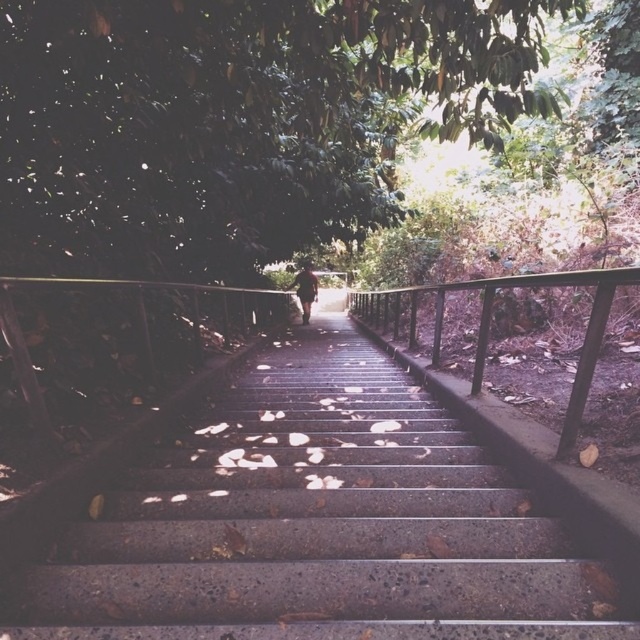
You are a delivery person carrying a package that is 1.8 meters long. You need to walk up the stairs shown in the image. Can you safely carry the package while passing through the space between the metallic black balustrade at center and the camera without tilting it sideways?

The distance between the metallic black balustrade at center and the camera is 2.07 meters, which is greater than the package length of 1.8 meters. Therefore, you can safely carry the package through that space without tilting it sideways.